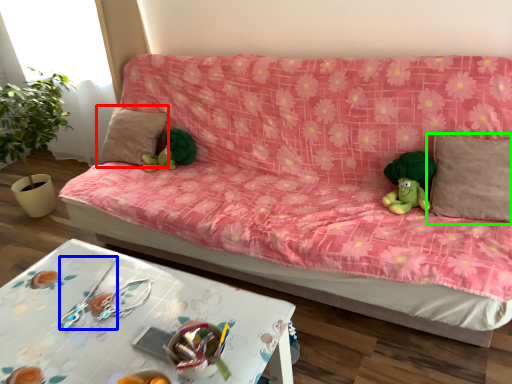
Question: Which object is positioned closest to pillow (highlighted by a red box)? Select from twin (highlighted by a blue box) and pillow (highlighted by a green box).

Choices:
 (A) twin
 (B) pillow

Answer: (A)